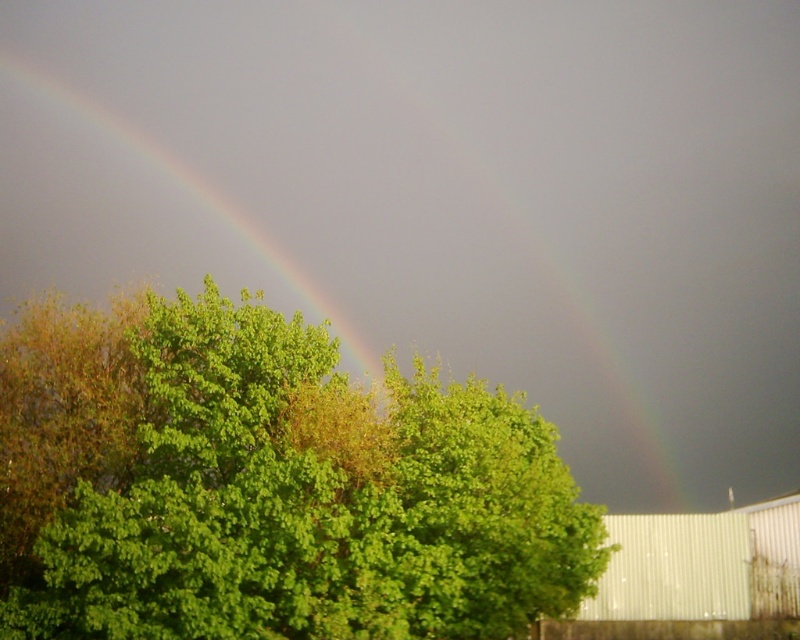
Find the location of `green leafy tree at center`. green leafy tree at center is located at coordinates (270, 486).

How much distance is there between green leafy tree at center and rainbow at upper left?

The distance of green leafy tree at center from rainbow at upper left is 15.24 meters.

Who is more distant from viewer, (54, 577) or (38, 202)?

The point (38, 202) is behind.

At what (x,y) coordinates should I click in order to perform the action: click on green leafy tree at center. Please return your answer as a coordinate pair (x, y). The image size is (800, 640). Looking at the image, I should click on (270, 486).